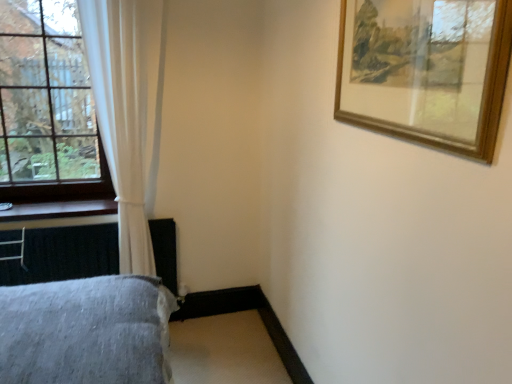
Question: In terms of width, does white sheer curtain at left look wider or thinner when compared to clear glass window at left?

Choices:
 (A) wide
 (B) thin

Answer: (A)

Question: In terms of size, does white sheer curtain at left appear bigger or smaller than clear glass window at left?

Choices:
 (A) big
 (B) small

Answer: (A)

Question: Estimate the real-world distances between objects in this image. Which object is closer to the clear glass window at left?

Choices:
 (A) white sheer curtain at left
 (B) wooden at left
 (C) wooden picture frame at upper right
 (D) gray fabric bed at lower left

Answer: (A)

Question: Estimate the real-world distances between objects in this image. Which object is closer to the wooden at left?

Choices:
 (A) clear glass window at left
 (B) gray fabric bed at lower left
 (C) wooden picture frame at upper right
 (D) white sheer curtain at left

Answer: (A)